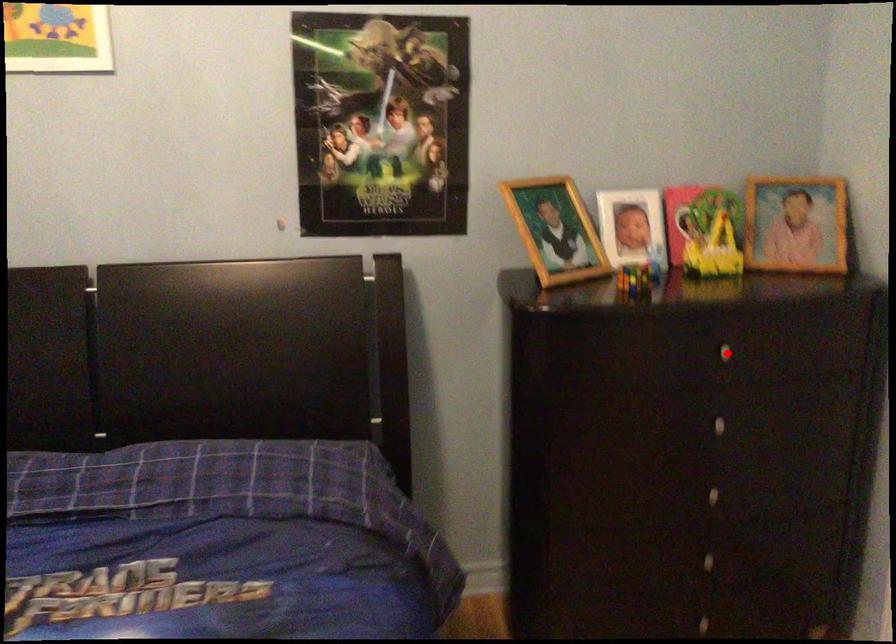
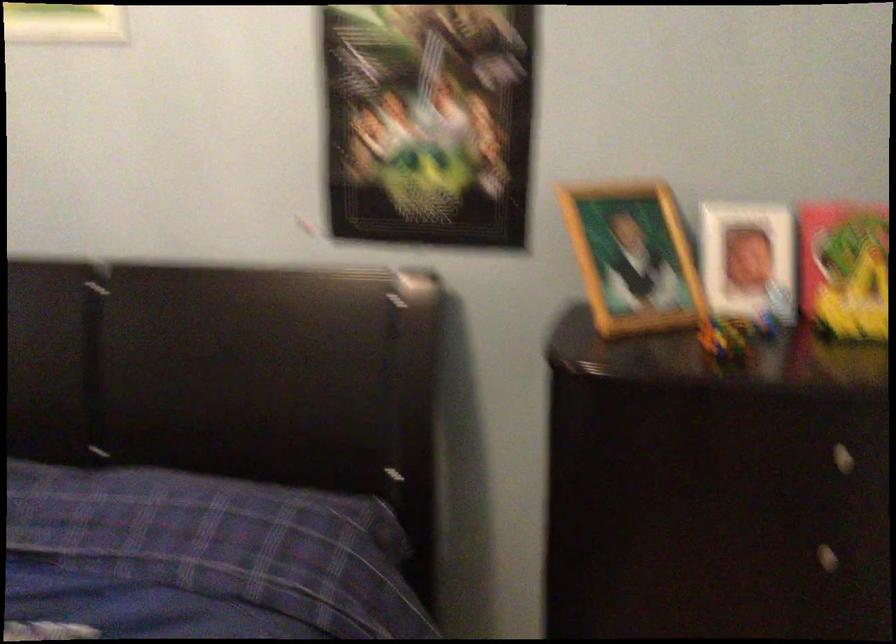
Locate, in the second image, the point that corresponds to the highlighted location in the first image.

(840, 458)